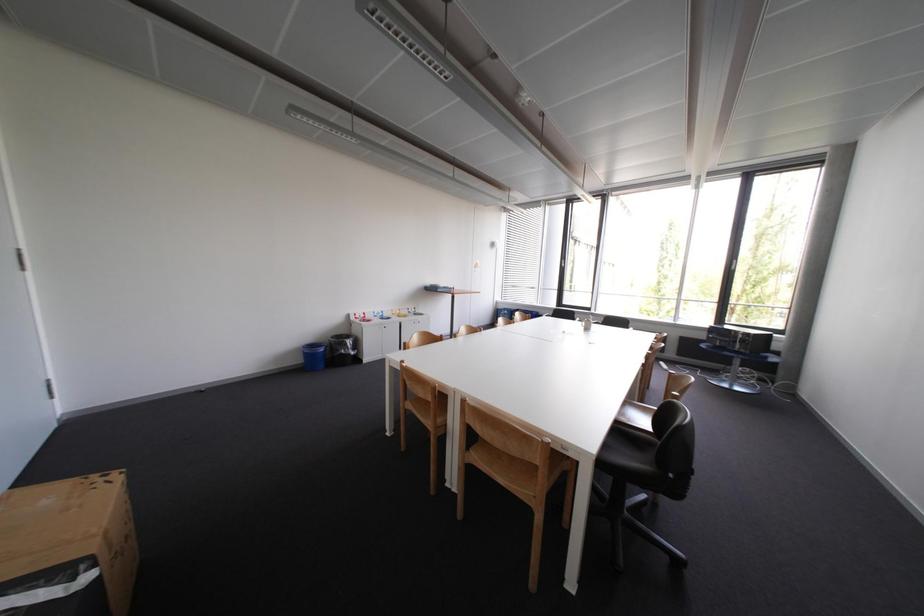
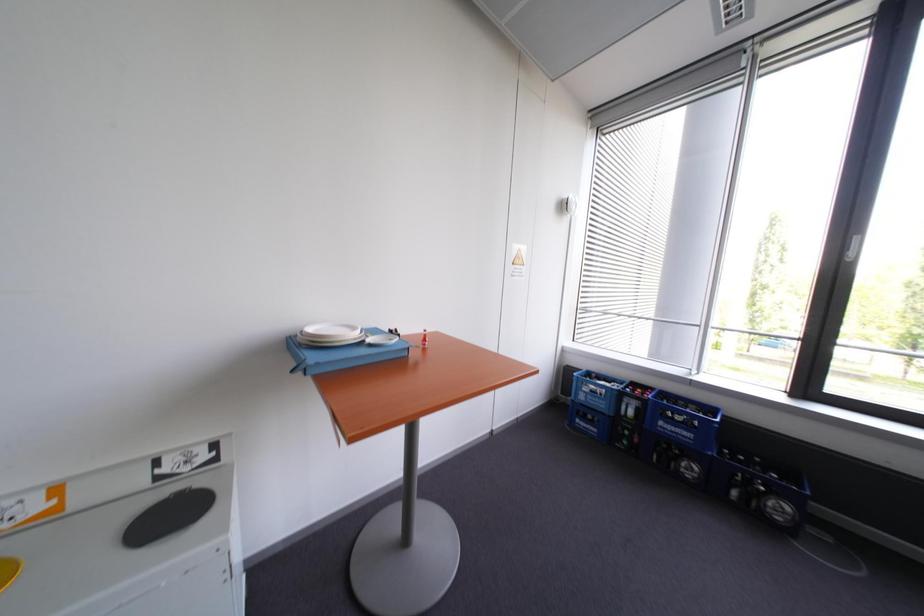
Question: The images are taken continuously from a first-person perspective. In which direction are you moving?

Choices:
 (A) Left
 (B) Right
 (C) Forward
 (D) Backward

Answer: (C)